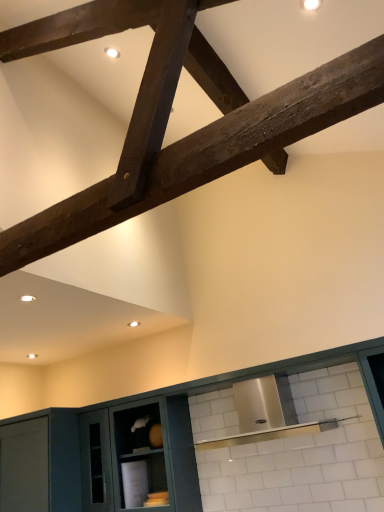
Question: Relative to dark brown wood beam at upper center, is matte green cabinetry at center in front or behind?

Choices:
 (A) behind
 (B) front

Answer: (A)

Question: Looking at their shapes, would you say matte green cabinetry at center is wider or thinner than dark brown wood beam at upper center?

Choices:
 (A) wide
 (B) thin

Answer: (B)

Question: From the image's perspective, is matte green cabinetry at center above or below dark brown wood beam at upper center?

Choices:
 (A) above
 (B) below

Answer: (B)

Question: From the image's perspective, is dark brown wood beam at upper center located above or below matte green cabinetry at center?

Choices:
 (A) above
 (B) below

Answer: (A)

Question: Visually, is dark brown wood beam at upper center positioned to the left or to the right of matte green cabinetry at center?

Choices:
 (A) right
 (B) left

Answer: (B)

Question: In terms of size, does dark brown wood beam at upper center appear bigger or smaller than matte green cabinetry at center?

Choices:
 (A) big
 (B) small

Answer: (B)

Question: Is point (188, 135) positioned closer to the camera than point (190, 474)?

Choices:
 (A) farther
 (B) closer

Answer: (A)